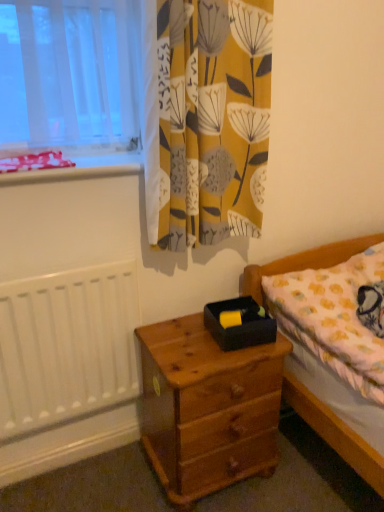
Question: Can you confirm if wooden nightstand at lower center is smaller than red plastic tray at upper left?

Choices:
 (A) yes
 (B) no

Answer: (B)

Question: Does wooden nightstand at lower center have a greater height compared to red plastic tray at upper left?

Choices:
 (A) no
 (B) yes

Answer: (B)

Question: From a real-world perspective, is wooden nightstand at lower center physically above red plastic tray at upper left?

Choices:
 (A) no
 (B) yes

Answer: (A)

Question: Are wooden nightstand at lower center and red plastic tray at upper left far apart?

Choices:
 (A) yes
 (B) no

Answer: (B)

Question: Is wooden nightstand at lower center at the right side of red plastic tray at upper left?

Choices:
 (A) no
 (B) yes

Answer: (B)

Question: Is black matte box at center in front of or behind yellow fabric curtain at upper center in the image?

Choices:
 (A) front
 (B) behind

Answer: (B)

Question: Based on their positions, is black matte box at center located to the left or right of yellow fabric curtain at upper center?

Choices:
 (A) right
 (B) left

Answer: (A)

Question: From the image's perspective, is black matte box at center above or below yellow fabric curtain at upper center?

Choices:
 (A) above
 (B) below

Answer: (B)

Question: Looking at the image, does black matte box at center seem bigger or smaller compared to yellow fabric curtain at upper center?

Choices:
 (A) small
 (B) big

Answer: (A)

Question: From the image's perspective, is wooden nightstand at lower center above or below black matte box at center?

Choices:
 (A) below
 (B) above

Answer: (A)

Question: Considering the positions of point (258, 433) and point (221, 333), is point (258, 433) closer or farther from the camera than point (221, 333)?

Choices:
 (A) farther
 (B) closer

Answer: (A)

Question: In the image, is wooden nightstand at lower center positioned in front of or behind black matte box at center?

Choices:
 (A) front
 (B) behind

Answer: (A)

Question: From a real-world perspective, is wooden nightstand at lower center above or below black matte box at center?

Choices:
 (A) below
 (B) above

Answer: (A)

Question: In terms of height, does wooden nightstand at lower center look taller or shorter compared to white painted radiator at left?

Choices:
 (A) short
 (B) tall

Answer: (A)

Question: Is point (175, 416) positioned closer to the camera than point (135, 280)?

Choices:
 (A) closer
 (B) farther

Answer: (A)